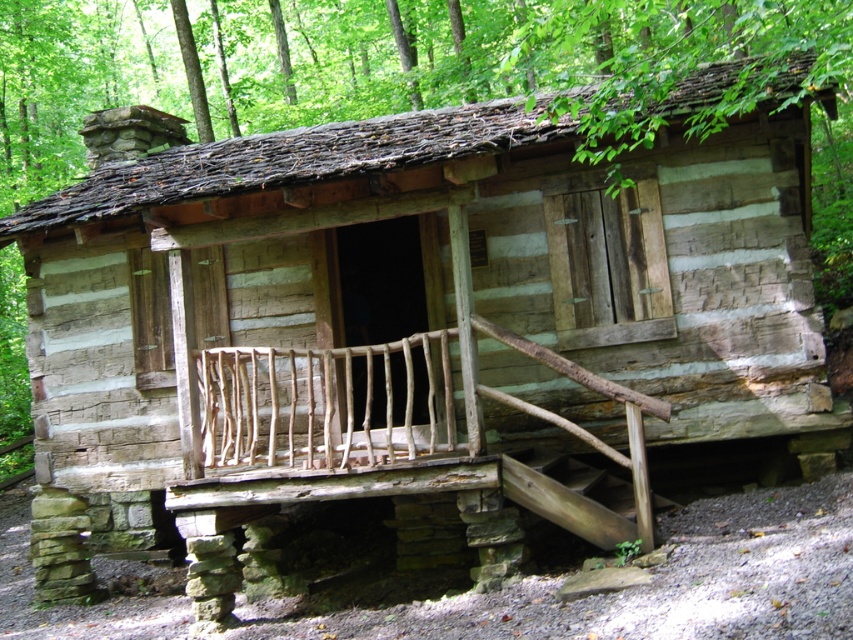
Which is below, rustic wooden porch at center or wooden stairs at lower center?

wooden stairs at lower center is lower down.

Does rustic wooden porch at center have a greater width compared to wooden stairs at lower center?

Yes.

Describe the element at coordinates (383, 433) in the screenshot. I see `rustic wooden porch at center` at that location.

I want to click on rustic wooden porch at center, so (x=383, y=433).